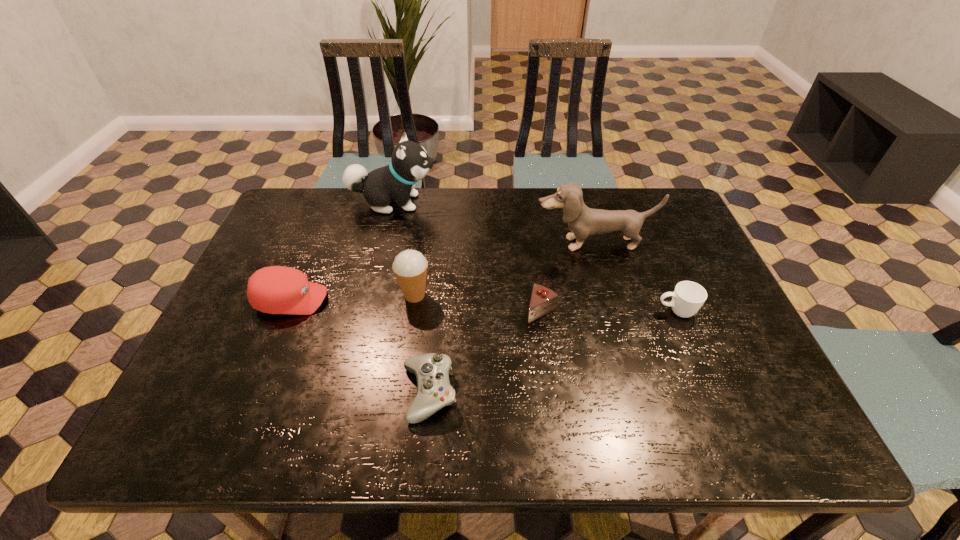
Where is `the farther puppy`? This screenshot has width=960, height=540. the farther puppy is located at coordinates click(x=409, y=163).

This screenshot has width=960, height=540. In order to click on the farthest object in this screenshot , I will do `click(409, 163)`.

The image size is (960, 540). I want to click on the right puppy, so click(583, 221).

This screenshot has height=540, width=960. I want to click on the nearer puppy, so click(583, 221).

At what (x,y) coordinates should I click in order to perform the action: click on the third tallest object. Please return your answer as a coordinate pair (x, y). Looking at the image, I should click on (410, 266).

I want to click on the fourth shortest object, so click(x=275, y=289).

This screenshot has width=960, height=540. Find the location of `cup`. cup is located at coordinates (688, 297).

Image resolution: width=960 pixels, height=540 pixels. In order to click on chocolate cake in this screenshot , I will do `click(543, 300)`.

Identify the location of the nearest object. This screenshot has height=540, width=960. pyautogui.click(x=434, y=391).

Locate an element on the screen. free space located 0.270m at the face of the farthest object is located at coordinates (520, 202).